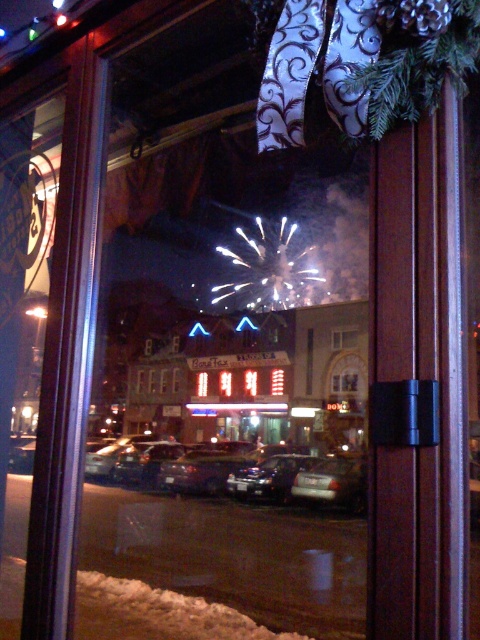
Question: Can you confirm if shiny black sedan at center is smaller than transparent glass window at center?

Choices:
 (A) no
 (B) yes

Answer: (B)

Question: Which of the following is the farthest from the observer?

Choices:
 (A) (336, 346)
 (B) (223, 480)

Answer: (A)

Question: Does shiny black sedan at center appear on the right side of transparent glass window at center?

Choices:
 (A) yes
 (B) no

Answer: (B)

Question: Does shiny black sedan at center appear under transparent glass window at center?

Choices:
 (A) yes
 (B) no

Answer: (A)